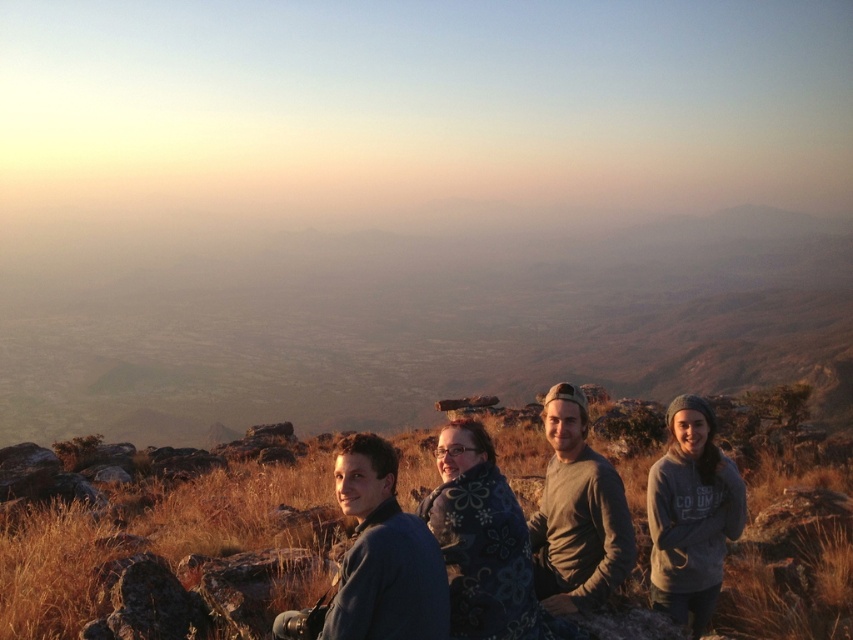
How much distance is there between floral-patterned blanket at center and gray fleece jacket at lower right?

They are 1.79 meters apart.

In the scene shown: Is floral-patterned blanket at center positioned at the back of gray fleece jacket at lower right?

No, floral-patterned blanket at center is closer to the viewer.

Which is in front, point (467, 545) or point (730, 516)?

Point (467, 545) is in front.

This screenshot has width=853, height=640. Identify the location of floral-patterned blanket at center. (480, 540).

Is floral-patterned blanket at center positioned at the back of green cotton shirt at center?

No, it is not.

Who is more distant from viewer, (433,506) or (543,529)?

The point (543,529) is more distant.

Is point (467, 560) behind point (549, 412)?

No, it is not.

You are a GUI agent. You are given a task and a screenshot of the screen. Output one action in this format:
    pyautogui.click(x=<x>, y=<y>)
    Task: Click on the floral-patterned blanket at center
    
    Given the screenshot: What is the action you would take?
    pyautogui.click(x=480, y=540)

Which is behind, point (550, 396) or point (744, 500)?

The point (550, 396) is more distant.

Does green cotton shirt at center have a smaller size compared to gray fleece jacket at lower right?

Incorrect, green cotton shirt at center is not smaller in size than gray fleece jacket at lower right.

Where is `green cotton shirt at center`? The height and width of the screenshot is (640, 853). green cotton shirt at center is located at coordinates (577, 513).